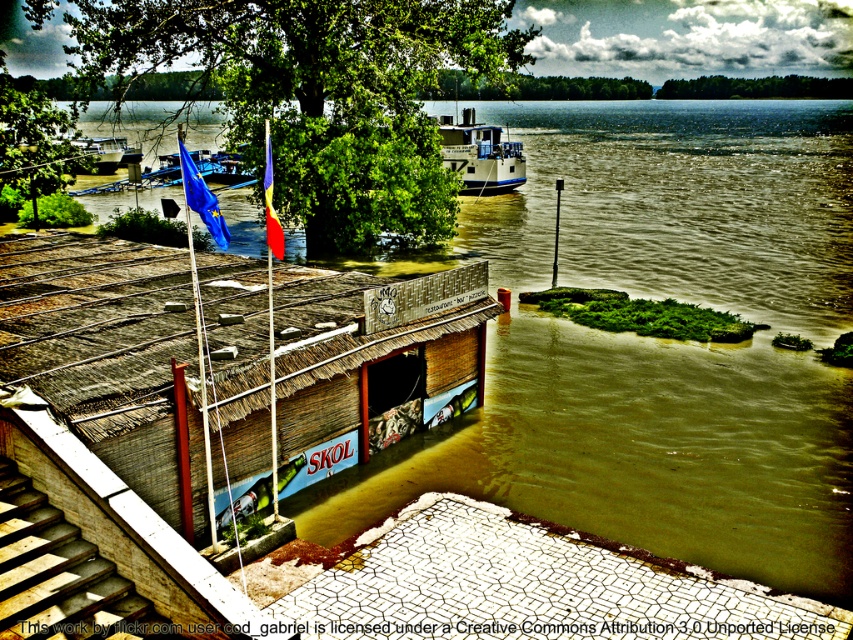
You are a rescue worker trying to reach the brown thatched hut at center from the wooden stairs at lower left. Considering the current water levels, which object would you prioritize checking first for safe passage?

The wooden stairs at lower left should be checked first because they are much shorter than the brown thatched hut at center, making them more vulnerable to being submerged by the rising water.

You are a rescue drone operator trying to navigate between two points in a flooded area. The first point is point (61, 394) and the second is point (84, 138). According to the scene, which point is closer to the observer?

Point (61, 394) is in front of point (84, 138), so the first point is closer to the observer.

From the picture: You are a rescue worker trying to reach the stranded people in the brown thatched hut at center. You have a white glossy boat at center available. Can you use the boat to reach the hut from your current position? Explain your reasoning.

The brown thatched hut at center and white glossy boat at center are 21.26 meters apart. Since the boat is available, you can use it to reach the hut as the distance is manageable for a boat in such a flooded area.